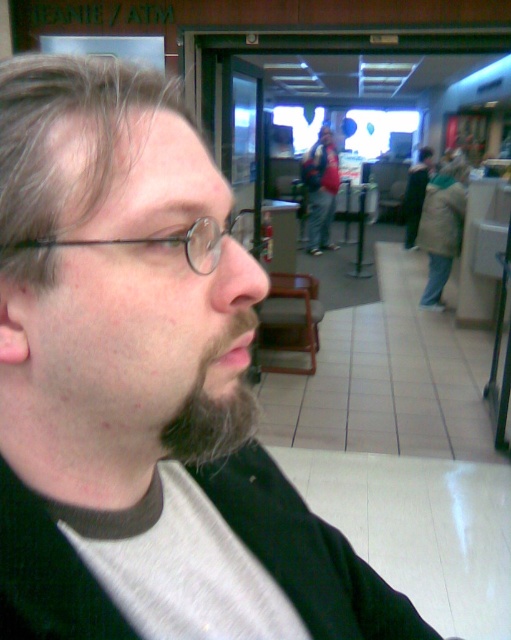
Question: Is dark brown fuzzy beard at lower left thinner than black metal glasses at left?

Choices:
 (A) no
 (B) yes

Answer: (B)

Question: Estimate the real-world distances between objects in this image. Which object is closer to the matte black backpack at center?

Choices:
 (A) black metal glasses at left
 (B) dark brown fuzzy beard at lower left

Answer: (A)

Question: Among these points, which one is nearest to the camera?

Choices:
 (A) (217, 378)
 (B) (332, 164)
 (C) (203, 252)

Answer: (C)

Question: Is dark brown fuzzy beard at lower left thinner than matte black backpack at center?

Choices:
 (A) no
 (B) yes

Answer: (B)

Question: Which object is the closest to the dark brown fuzzy beard at lower left?

Choices:
 (A) black metal glasses at left
 (B) matte black backpack at center

Answer: (A)

Question: Does black metal glasses at left appear on the left side of matte black backpack at center?

Choices:
 (A) yes
 (B) no

Answer: (A)